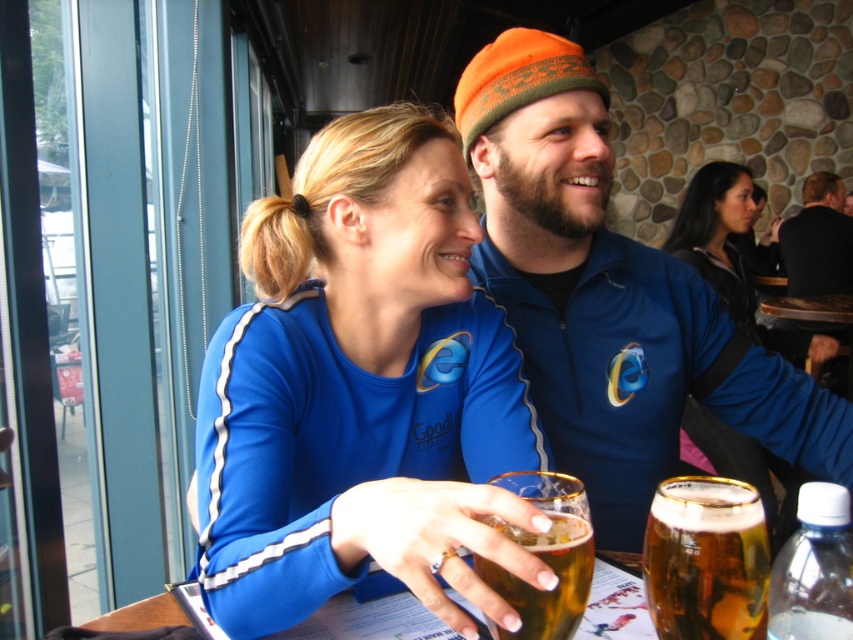
Between blue fleece jacket at center and amber glass at center, which one appears on the right side from the viewer's perspective?

Positioned to the right is blue fleece jacket at center.

Can you confirm if blue fleece jacket at center is positioned above amber glass at center?

Correct, blue fleece jacket at center is located above amber glass at center.

Is point (666, 378) farther from camera compared to point (720, 508)?

Yes, point (666, 378) is farther from viewer.

Locate an element on the screen. The image size is (853, 640). blue fleece jacket at center is located at coordinates (611, 298).

Is amber glass at center smaller than translucent glass beer at center?

Yes.

Can you confirm if amber glass at center is positioned to the right of translucent glass beer at center?

Yes, amber glass at center is to the right of translucent glass beer at center.

Between point (660, 625) and point (550, 518), which one is positioned in front?

Point (550, 518) is more forward.

This screenshot has height=640, width=853. What are the coordinates of `amber glass at center` in the screenshot? It's located at (705, 557).

Can you confirm if blue fabric shirt at center is bigger than black fleece jacket at upper right?

No, blue fabric shirt at center is not bigger than black fleece jacket at upper right.

Between blue fabric shirt at center and black fleece jacket at upper right, which one has more height?

With more height is black fleece jacket at upper right.

Does point (465, 333) lie in front of point (815, 212)?

Yes, it is in front of point (815, 212).

Locate an element on the screen. Image resolution: width=853 pixels, height=640 pixels. blue fabric shirt at center is located at coordinates (360, 388).